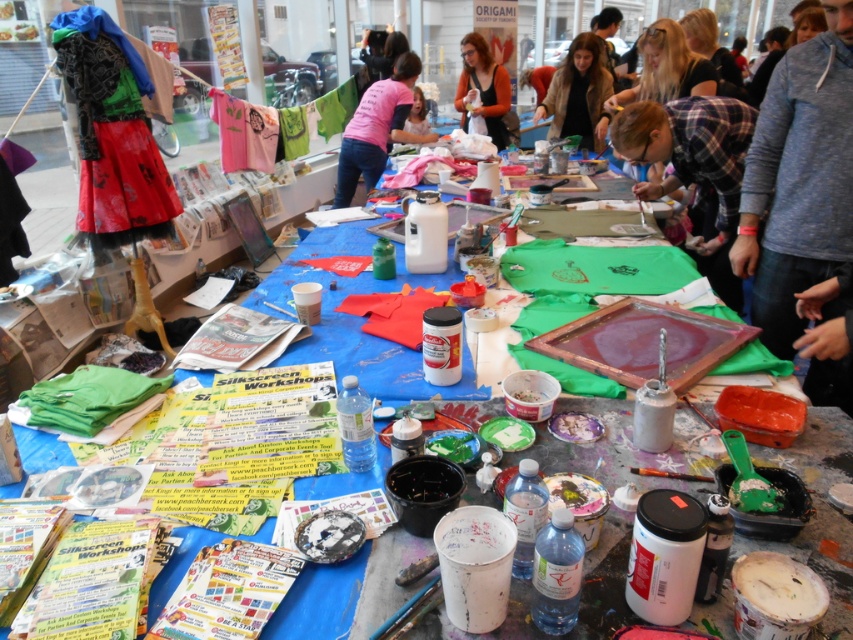
You need to place a new item on the table in the image. The gray sweater at upper right and the pink fabric at center are already there. Which object should you move to make more space?

You should move the gray sweater at upper right because it occupies less space than the pink fabric at center, so moving it would free up more space.

You are standing at the entrance of the room and see two points on the table. The first point is at coordinate point(796, 113) and the second is at point(460, 92). Which point is closer to you?

Point(796, 113) is in front of point(460, 92), so it is closer to you.